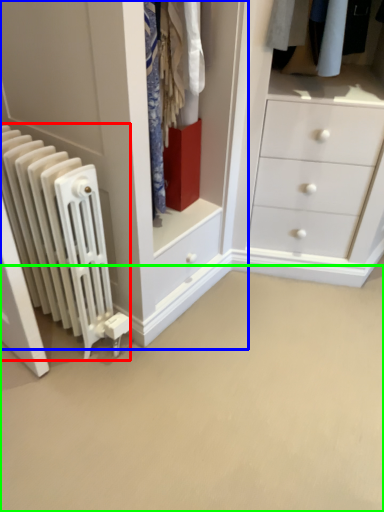
Question: Considering the real-world distances, which object is closest to radiator (highlighted by a red box)? closet (highlighted by a blue box) or plain (highlighted by a green box).

Choices:
 (A) closet
 (B) plain

Answer: (A)